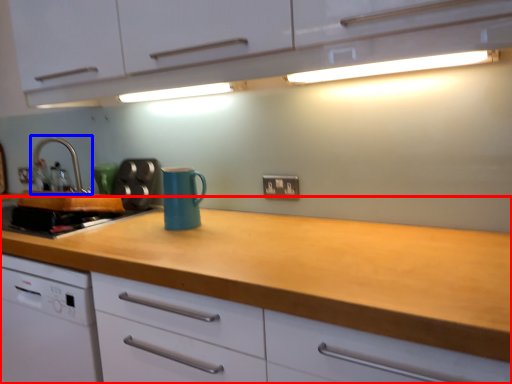
Question: Which object appears farthest to the camera in this image, counter (highlighted by a red box) or tap (highlighted by a blue box)?

Choices:
 (A) counter
 (B) tap

Answer: (B)